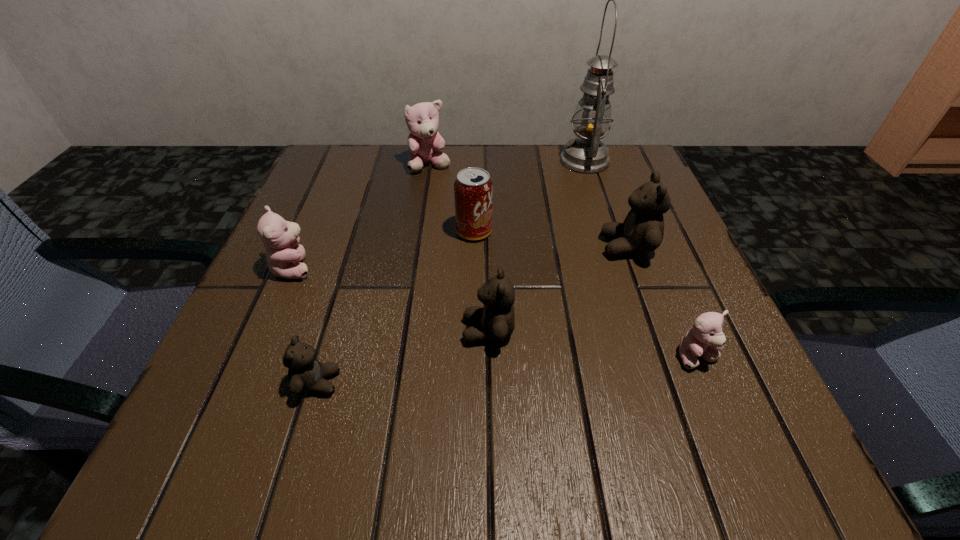
This screenshot has height=540, width=960. In order to click on object that is positioned at the far right corner in this screenshot , I will do `click(586, 154)`.

The height and width of the screenshot is (540, 960). I want to click on free space at the far edge, so click(x=543, y=183).

Where is `vacant space at the near edge`? vacant space at the near edge is located at coordinates (336, 438).

The width and height of the screenshot is (960, 540). I want to click on vacant area at the left edge, so click(x=357, y=256).

In the image, there is a desktop. Identify the location of vacant area at the right edge. This screenshot has width=960, height=540. (653, 322).

Find the location of a particular element. vacant space at the far left corner of the desktop is located at coordinates (370, 199).

Find the location of `free space at the near right corner of the desktop`. free space at the near right corner of the desktop is located at coordinates tap(720, 479).

Locate an element on the screen. free area in between the sixth object from right to left and the smallest pink teddy bear is located at coordinates (564, 261).

The height and width of the screenshot is (540, 960). I want to click on blank region between the second biggest brown teddy bear and the nearest brown teddy bear, so click(x=403, y=356).

The width and height of the screenshot is (960, 540). Find the location of `vacant area between the second farthest brown teddy bear and the second farthest pink teddy bear`. vacant area between the second farthest brown teddy bear and the second farthest pink teddy bear is located at coordinates [391, 299].